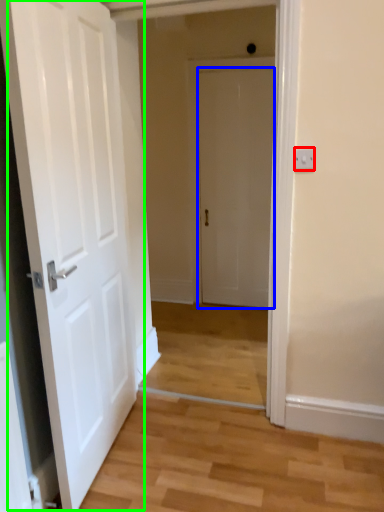
Question: Estimate the real-world distances between objects in this image. Which object is closer to electric outlet (highlighted by a red box), door (highlighted by a blue box) or door (highlighted by a green box)?

Choices:
 (A) door
 (B) door

Answer: (B)